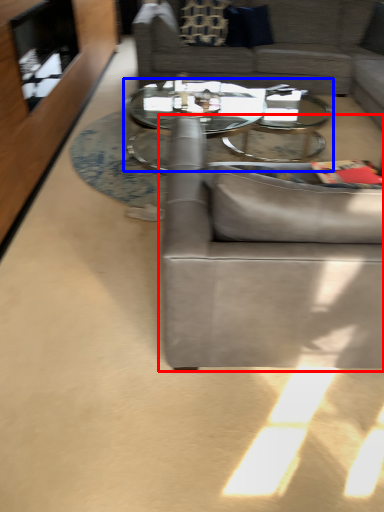
Question: Which point is further to the camera, studio couch (highlighted by a red box) or coffee table (highlighted by a blue box)?

Choices:
 (A) studio couch
 (B) coffee table

Answer: (B)